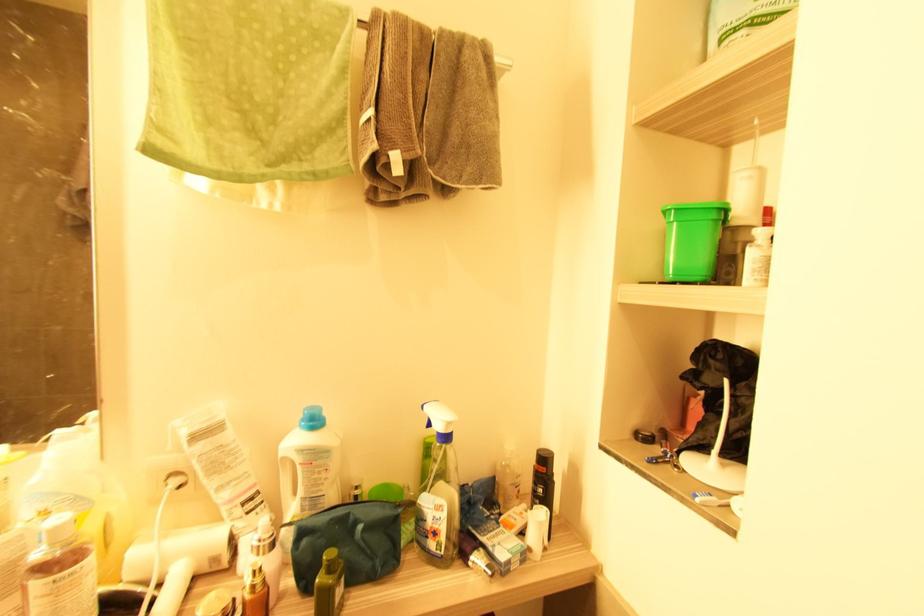
Describe the element at coordinates (309, 466) in the screenshot. I see `a white detergent bottle` at that location.